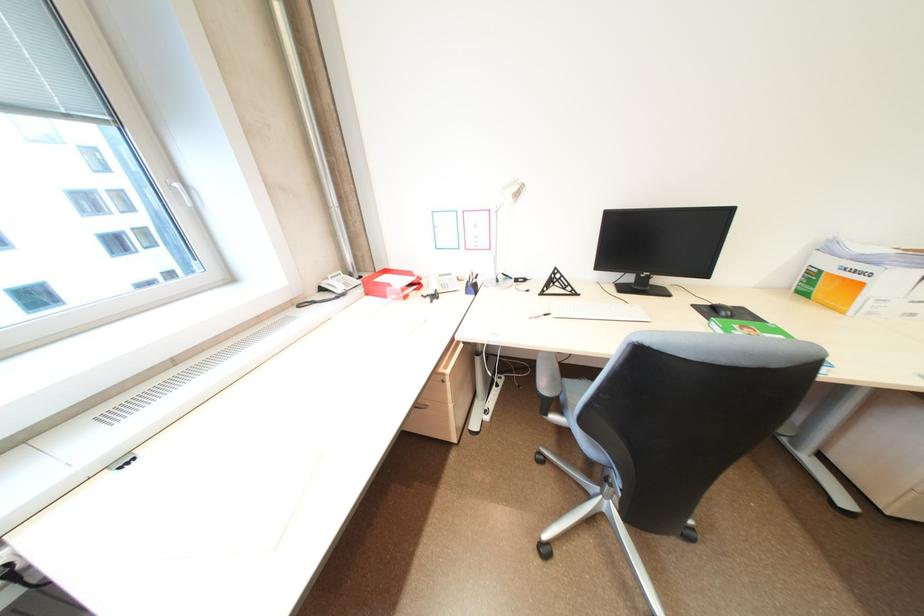
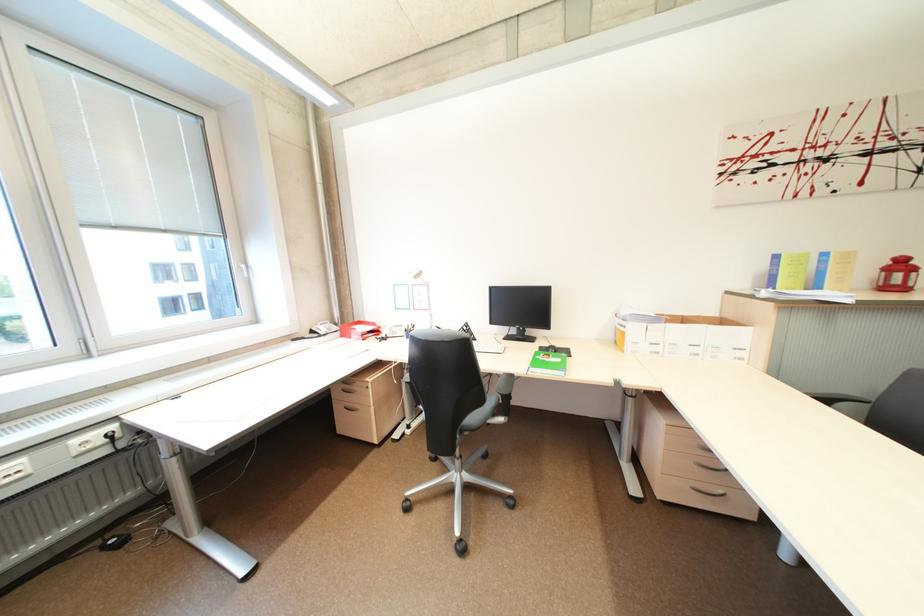
What movement of the cameraman would produce the second image?

The cameraman walked toward right, backward.